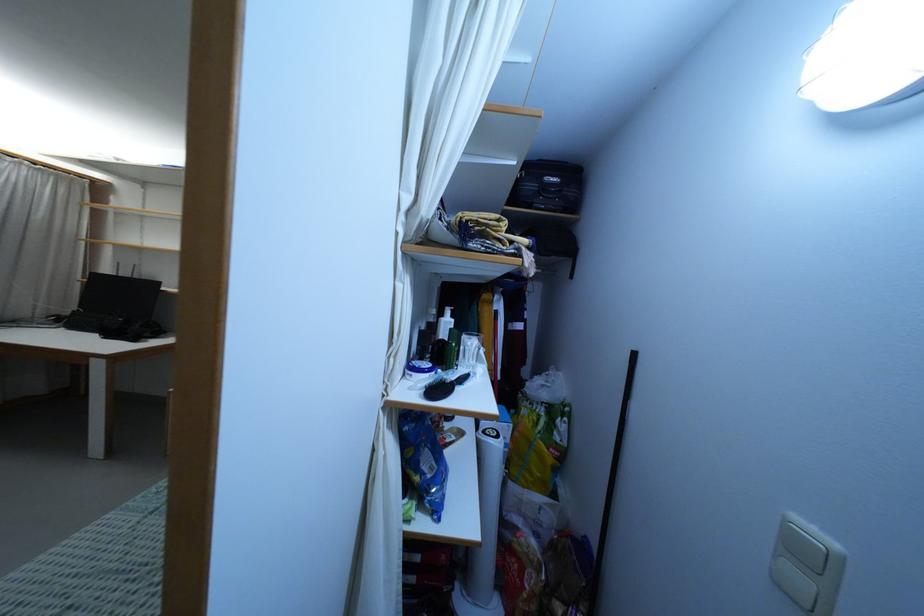
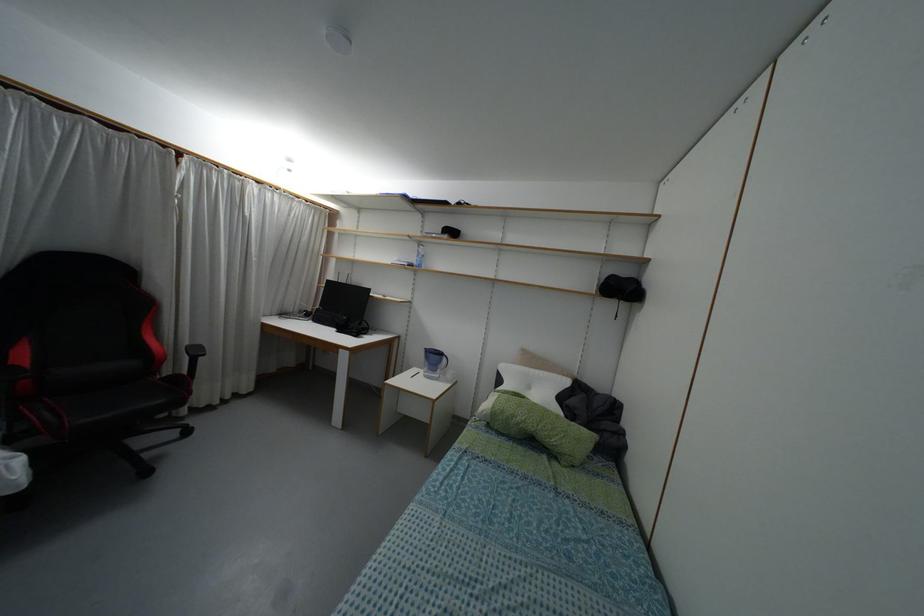
Question: The first image is from the beginning of the video and the second image is from the end. How did the camera likely rotate when shooting the video?

Choices:
 (A) Left
 (B) Right
 (C) Up
 (D) Down

Answer: (A)